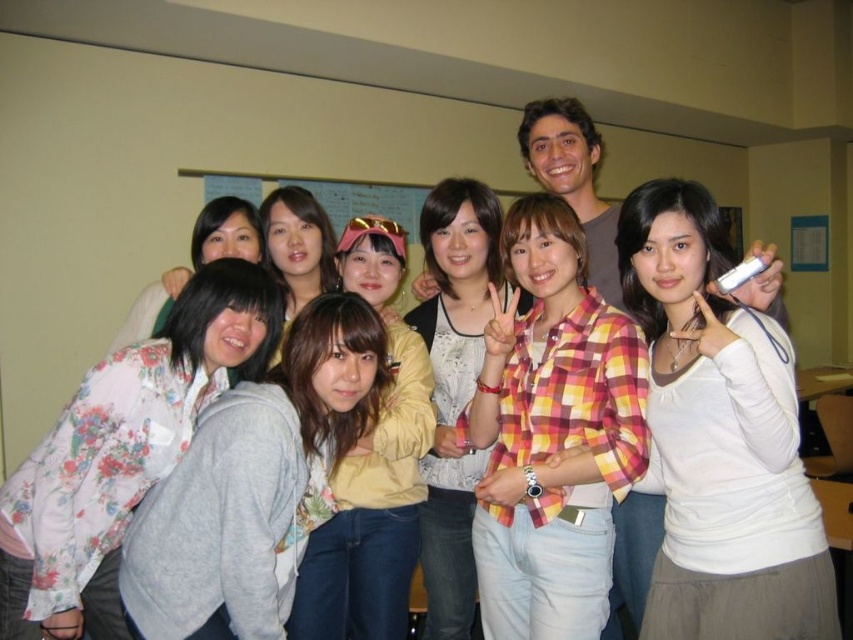
You are organizing a photo shoot and need to arrange two yellow shirts in the image. The yellow plaid shirt at center and the yellow fabric shirt at center must be positioned such that one is taller than the other. Based on the scene description, which shirt should be placed higher to match the original image?

The yellow plaid shirt at center should be placed higher because it is taller than the yellow fabric shirt at center in the original image.

You are a photographer trying to capture a closeup of the gray fleece jacket at center without including the floral fabric blouse at left in the frame. Is this possible given their positions?

The gray fleece jacket at center is positioned under the floral fabric blouse at left, so it is possible to capture a closeup of the gray fleece jacket at center without including the floral fabric blouse at left by adjusting the camera angle to focus downward.

You are a photographer trying to adjust the lighting for a group photo. You notice the gray fleece jacket at center and the floral fabric blouse at left. Which object is closer to the camera?

The gray fleece jacket at center is closer to the camera because it is in front of the floral fabric blouse at left.